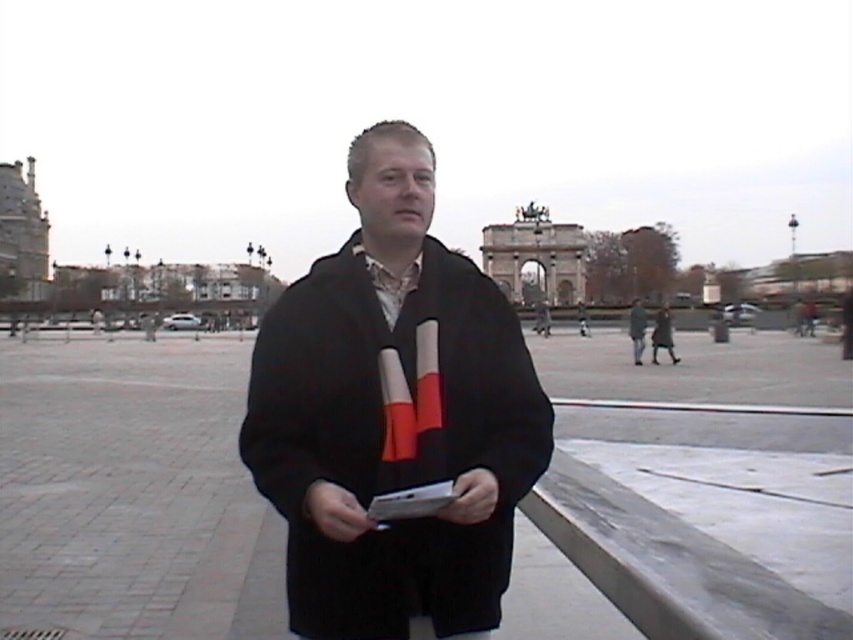
You are standing at the base of the archway in the image. You want to walk straight towards the man in the foreground. Will you step on the brick pavement at center marked by point [132,492]?

Yes, walking straight towards the man in the foreground from the base of the archway will lead you directly to the brick pavement at center marked by point [132,492] because that is the central path indicated by the coordinates.

You are a delivery person who needs to place a package on the ground. You see the brick pavement at center and the dark gray wool coat at center. Which surface can you place the package on?

The brick pavement at center is positioned under dark gray wool coat at center, so the package can be placed on the brick pavement at center.

In the scene shown: You are standing in the public square and want to take a photo of the archway in the background. You notice two points marked on the ground at coordinates point (822, 596) and point (431, 209). Which point should you stand closer to in order to ensure the archway is fully visible in your photo?

You should stand closer to point (431, 209) because point (822, 596) is behind it, meaning the archway will be more visible from the front point.